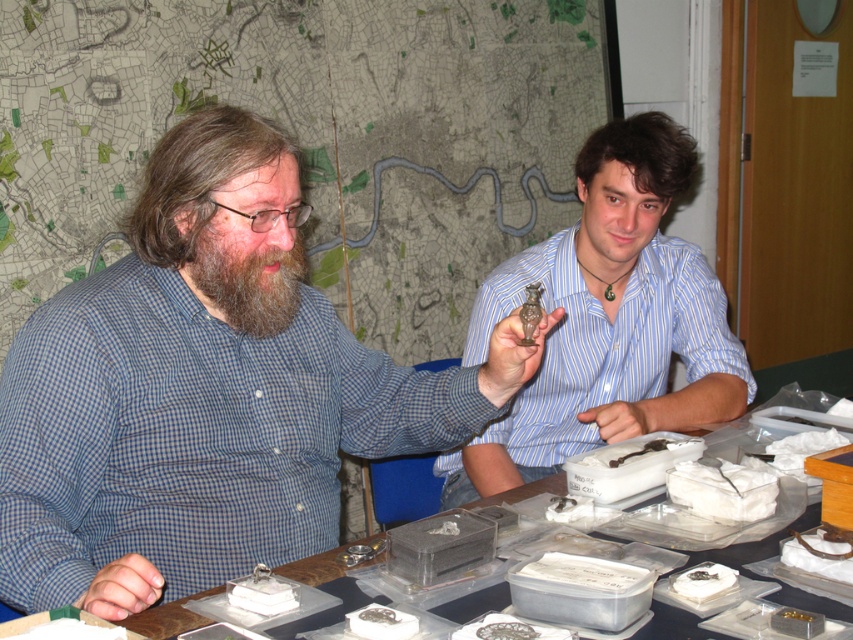
Question: Which point is farther from the camera taking this photo?

Choices:
 (A) (672, 500)
 (B) (706, 598)
 (C) (672, 460)
 (D) (355, 625)

Answer: (C)

Question: Which point is farther from the camera taking this photo?

Choices:
 (A) (209, 266)
 (B) (688, 458)
 (C) (500, 628)

Answer: (B)

Question: Which object is farther from the camera taking this photo?

Choices:
 (A) white paper plate at lower center
 (B) white paper food at center
 (C) blue striped shirt at center

Answer: (C)

Question: Does white matte food at lower right appear over white paper plate at lower center?

Choices:
 (A) yes
 (B) no

Answer: (A)

Question: Is green matte food at lower left to the right of brown matte food at center from the viewer's perspective?

Choices:
 (A) no
 (B) yes

Answer: (A)

Question: Is translucent plastic containers at center to the right of white paper plate at lower center from the viewer's perspective?

Choices:
 (A) no
 (B) yes

Answer: (B)